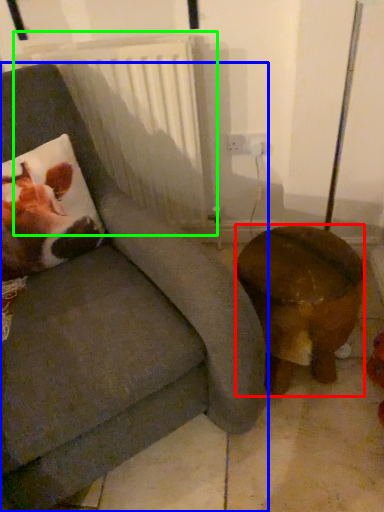
Question: Which object is the closest to the furniture (highlighted by a red box)? Choose among these: chair (highlighted by a blue box) or radiator (highlighted by a green box).

Choices:
 (A) chair
 (B) radiator

Answer: (A)